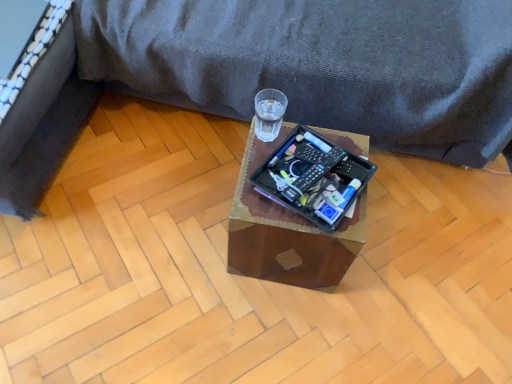
Where is `blank space above wooden tray at center (from a real-world perspective)`? The image size is (512, 384). blank space above wooden tray at center (from a real-world perspective) is located at coordinates (294, 170).